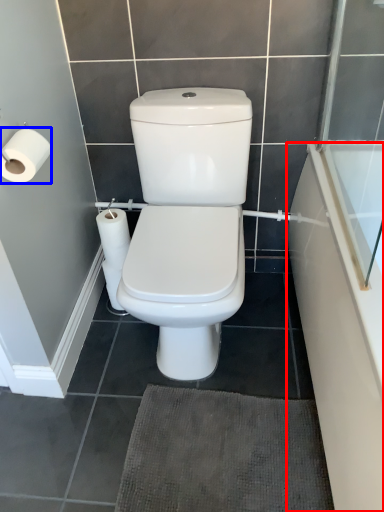
Question: Which point is closer to the camera, bath (highlighted by a red box) or toilet paper (highlighted by a blue box)?

Choices:
 (A) bath
 (B) toilet paper

Answer: (A)